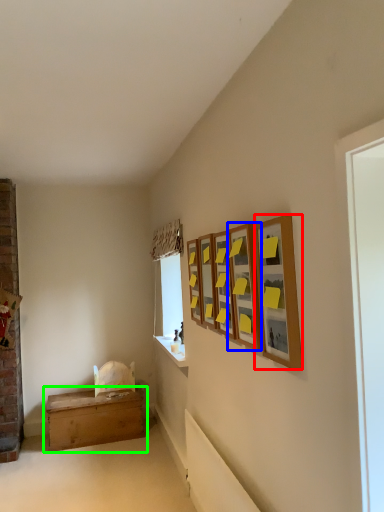
Question: Estimate the real-world distances between objects in this image. Which object is closer to picture frame (highlighted by a red box), picture frame (highlighted by a blue box) or table (highlighted by a green box)?

Choices:
 (A) picture frame
 (B) table

Answer: (A)